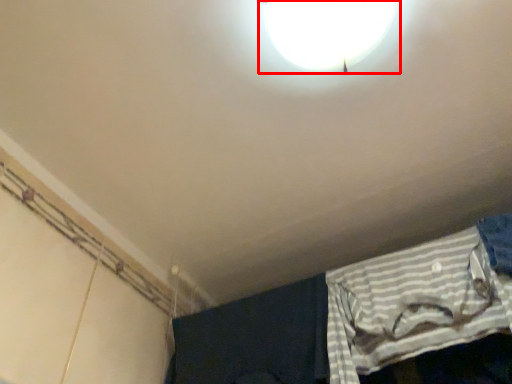
Question: From the image's perspective, where is lamp (annotated by the red box) located in relation to curtain in the image?

Choices:
 (A) below
 (B) above

Answer: (B)